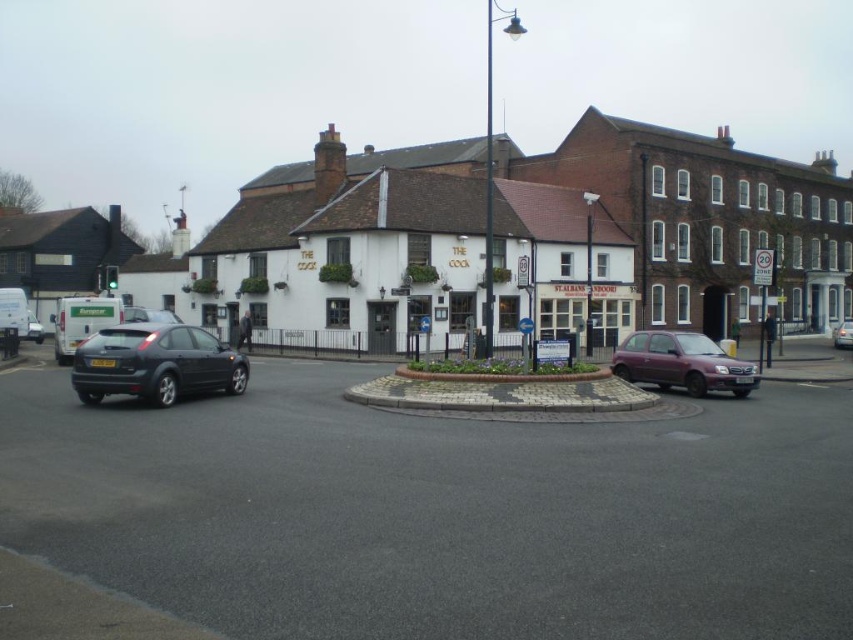
Question: Does matte black hatchback at left have a greater width compared to purple metallic hatchback at lower right?

Choices:
 (A) yes
 (B) no

Answer: (B)

Question: Considering the real-world distances, which object is farthest from the purple metallic hatchback at lower right?

Choices:
 (A) matte black hatchback at left
 (B) matte black car at left

Answer: (B)

Question: Can you confirm if matte black hatchback at left is positioned above purple metallic hatchback at lower right?

Choices:
 (A) no
 (B) yes

Answer: (A)

Question: Considering the real-world distances, which object is closest to the matte black hatchback at left?

Choices:
 (A) matte black car at left
 (B) purple metallic hatchback at lower right

Answer: (B)

Question: Is matte black hatchback at left to the left of purple metallic hatchback at lower right from the viewer's perspective?

Choices:
 (A) yes
 (B) no

Answer: (A)

Question: Which object is closer to the camera taking this photo?

Choices:
 (A) black asphalt at center
 (B) purple metallic hatchback at lower right
 (C) matte black hatchback at left

Answer: (A)